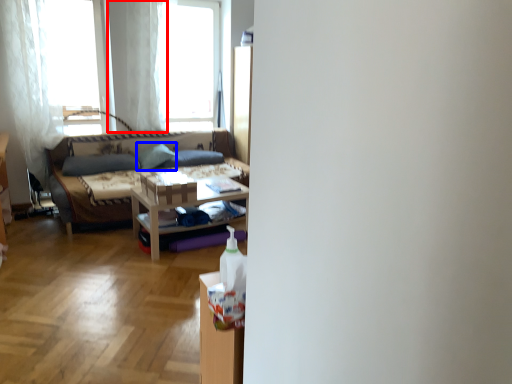
Question: Which object is closer to the camera taking this photo, curtain (highlighted by a red box) or pillow (highlighted by a blue box)?

Choices:
 (A) curtain
 (B) pillow

Answer: (A)